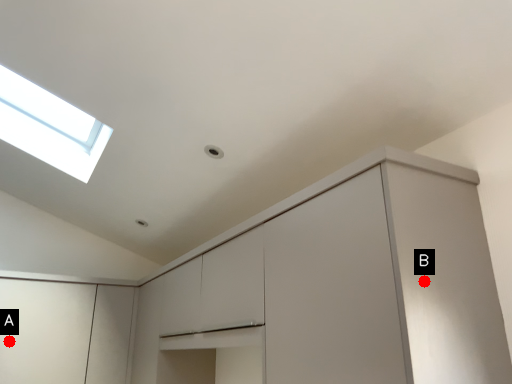
Question: Two points are circled on the image, labeled by A and B beside each circle. Which point is closer to the camera?

Choices:
 (A) A is closer
 (B) B is closer

Answer: (B)